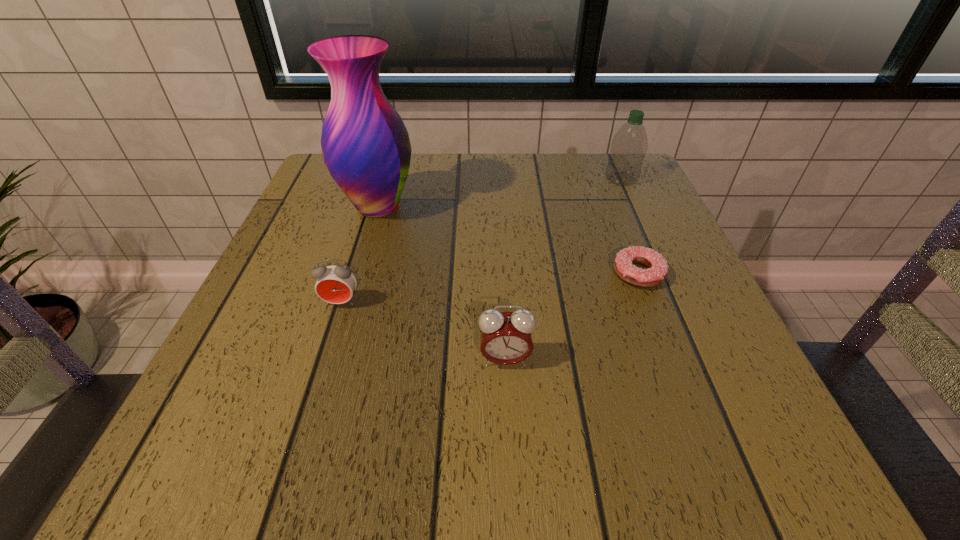
Where is `unoccupied position between the fourth tallest object and the vase`? This screenshot has width=960, height=540. unoccupied position between the fourth tallest object and the vase is located at coordinates (359, 254).

Find the location of `blank region between the second nearest object and the third farthest object`. blank region between the second nearest object and the third farthest object is located at coordinates (490, 288).

You are a GUI agent. You are given a task and a screenshot of the screen. Output one action in this format:
    pyautogui.click(x=<x>, y=<y>)
    Task: Click on the vacant space that is in between the tallest object and the shorter alarm clock
    The width and height of the screenshot is (960, 540).
    Given the screenshot: What is the action you would take?
    pyautogui.click(x=359, y=254)

Where is `free space between the shorter alarm clock and the second tallest object`? free space between the shorter alarm clock and the second tallest object is located at coordinates (481, 241).

At what (x,y) coordinates should I click in order to perform the action: click on vacant space in between the water bottle and the tallest object. Please return your answer as a coordinate pair (x, y). Looking at the image, I should click on (499, 193).

The width and height of the screenshot is (960, 540). In order to click on free space between the doughnut and the tallest object in this screenshot , I will do `click(508, 240)`.

Find the location of `object that can be found as the second closest to the third farthest object`. object that can be found as the second closest to the third farthest object is located at coordinates click(x=629, y=146).

Point out which object is positioned as the fourth nearest to the doughnut. Please provide its 2D coordinates. Your answer should be formatted as a tuple, i.e. [(x, y)], where the tuple contains the x and y coordinates of a point satisfying the conditions above.

[(335, 284)]

You are a GUI agent. You are given a task and a screenshot of the screen. Output one action in this format:
    pyautogui.click(x=<x>, y=<y>)
    Task: Click on the free point that satisfies the following two spatial constraints: 1. on the back side of the second tallest object; 2. on the right side of the vase
    The image size is (960, 540).
    Given the screenshot: What is the action you would take?
    pyautogui.click(x=386, y=179)